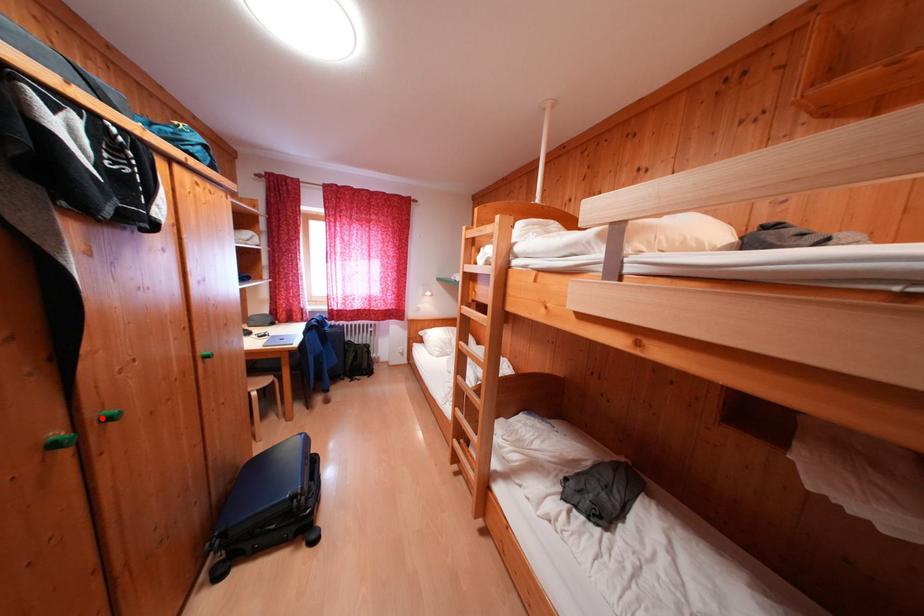
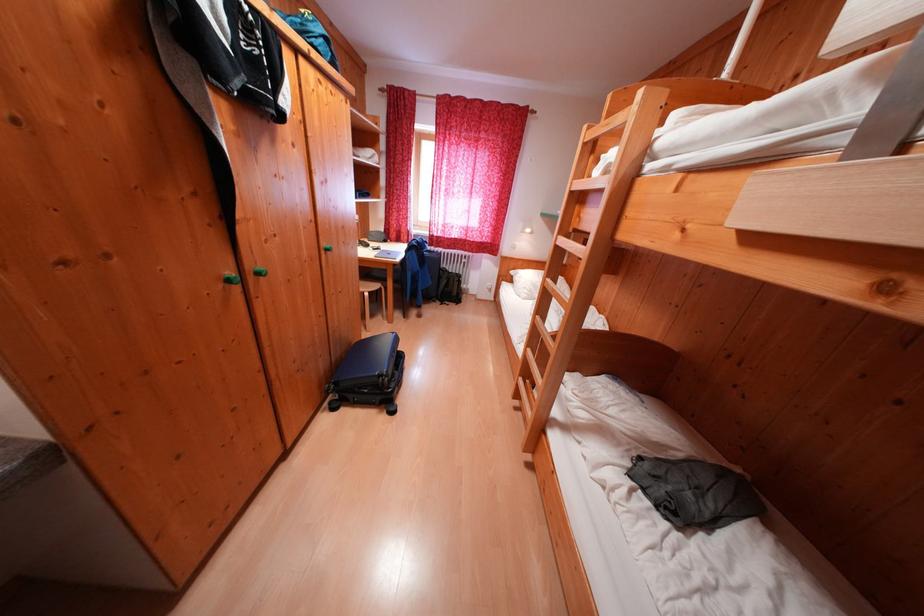
In the second image, find the point that corresponds to the highlighted location in the first image.

(258, 272)